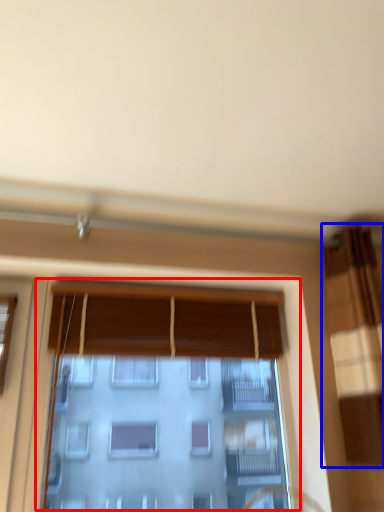
Question: Which point is further to the camera, window (highlighted by a red box) or curtain (highlighted by a blue box)?

Choices:
 (A) window
 (B) curtain

Answer: (A)